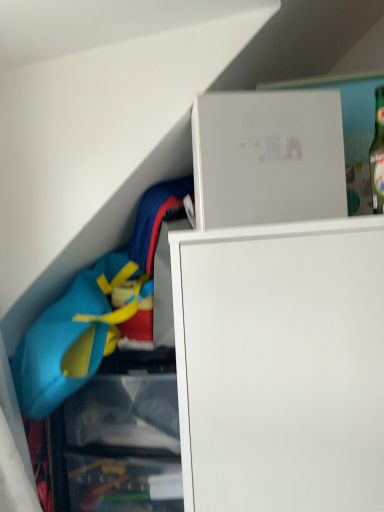
Question: Is white matte box at upper center in front of or behind matte blue life vest at left in the image?

Choices:
 (A) front
 (B) behind

Answer: (A)

Question: From a real-world perspective, relative to matte blue life vest at left, is white matte box at upper center vertically above or below?

Choices:
 (A) below
 (B) above

Answer: (B)

Question: Considering the positions of white matte box at upper center and matte blue life vest at left in the image, is white matte box at upper center wider or thinner than matte blue life vest at left?

Choices:
 (A) thin
 (B) wide

Answer: (A)

Question: Considering the relative positions of matte blue life vest at left and white matte box at upper center in the image provided, is matte blue life vest at left to the left or to the right of white matte box at upper center?

Choices:
 (A) left
 (B) right

Answer: (A)

Question: Based on their sizes in the image, would you say matte blue life vest at left is bigger or smaller than white matte box at upper center?

Choices:
 (A) small
 (B) big

Answer: (B)

Question: Is matte blue life vest at left inside the boundaries of white matte box at upper center, or outside?

Choices:
 (A) outside
 (B) inside

Answer: (A)

Question: From a real-world perspective, is matte blue life vest at left positioned above or below white matte box at upper center?

Choices:
 (A) below
 (B) above

Answer: (A)